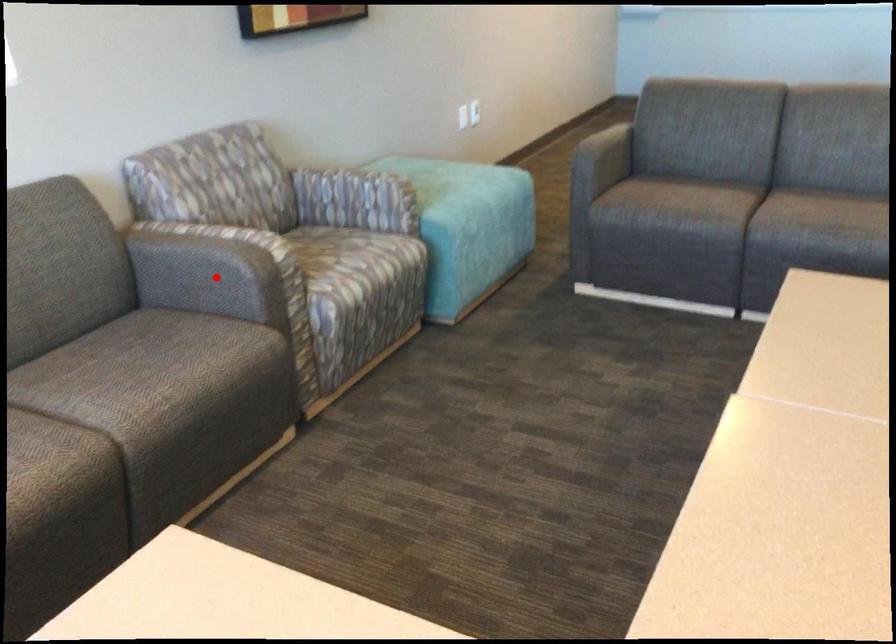
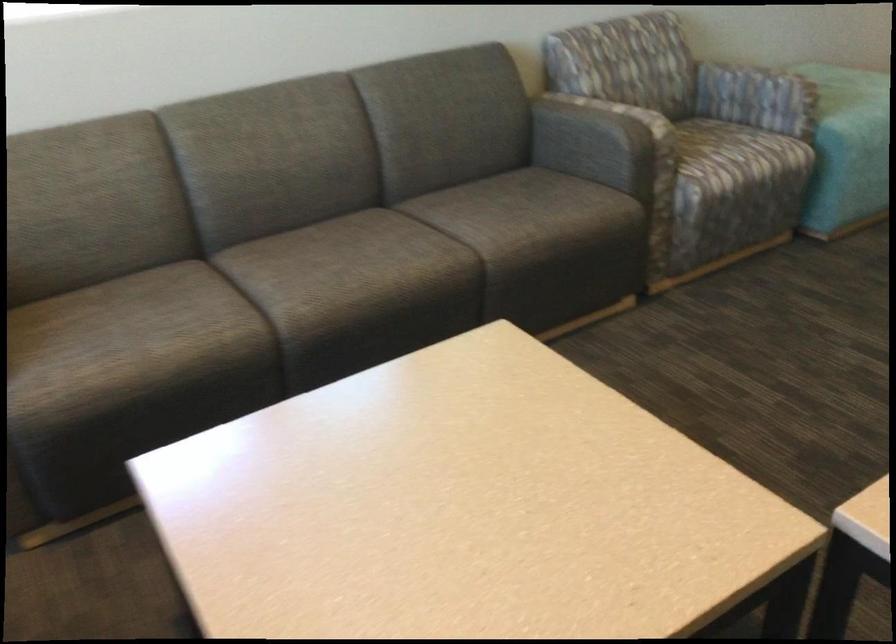
In the second image, find the point that corresponds to the highlighted location in the first image.

(597, 140)